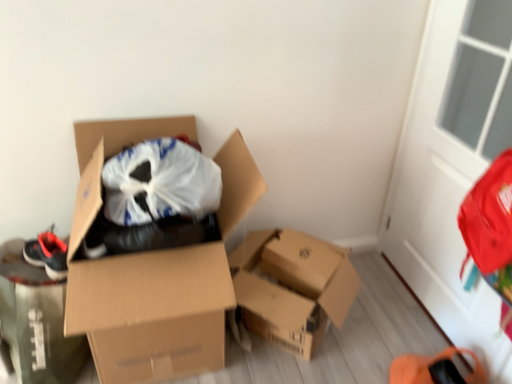
Question: From their relative heights in the image, would you say cardboard box at center, the second box from the right, is taller or shorter than cardboard box at center, acting as the first box starting from the right?

Choices:
 (A) tall
 (B) short

Answer: (A)

Question: From a real-world perspective, is cardboard box at center, the second box from the right, above or below cardboard box at center, which ranks as the second box in left-to-right order?

Choices:
 (A) above
 (B) below

Answer: (A)

Question: Estimate the real-world distances between objects in this image. Which object is closer to the matte black shoe at left?

Choices:
 (A) cardboard box at center, the first box positioned from the left
 (B) cardboard box at center, acting as the first box starting from the right
 (C) white glass screen door at upper right

Answer: (A)

Question: Based on their relative distances, which object is nearer to the white glass screen door at upper right?

Choices:
 (A) cardboard box at center, the second box from the right
 (B) matte black shoe at left
 (C) cardboard box at center, acting as the first box starting from the right

Answer: (C)